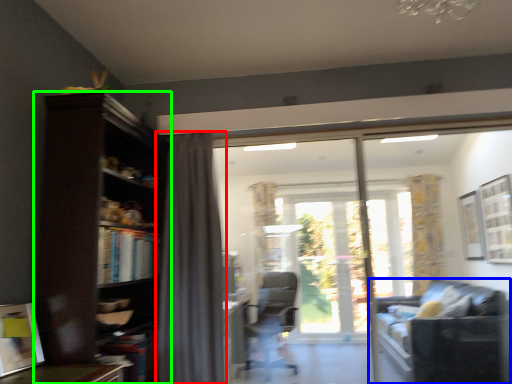
Question: Which is nearer to the curtain (highlighted by a red box)? studio couch (highlighted by a blue box) or bookcase (highlighted by a green box).

Choices:
 (A) studio couch
 (B) bookcase

Answer: (B)